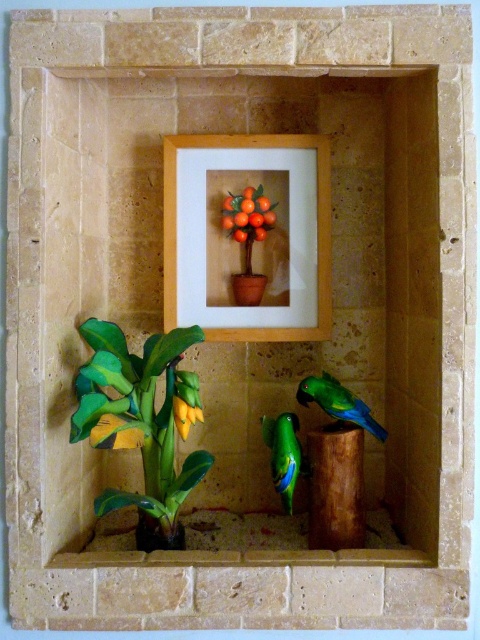
Is orange matte/orange-painted flower at upper center to the left of yellow matte flower at lower center from the viewer's perspective?

Incorrect, orange matte/orange-painted flower at upper center is not on the left side of yellow matte flower at lower center.

Does orange matte/orange-painted flower at upper center appear on the right side of yellow matte flower at lower center?

Yes, orange matte/orange-painted flower at upper center is to the right of yellow matte flower at lower center.

Between point (237, 220) and point (189, 396), which one is positioned in front?

Point (189, 396) is more forward.

Find the location of a particular element. This screenshot has width=480, height=640. orange matte/orange-painted flower at upper center is located at coordinates (248, 214).

Who is lower down, wooden frame at center or green matte parrot at lower right?

Positioned lower is green matte parrot at lower right.

Who is higher up, wooden frame at center or green matte parrot at lower right?

wooden frame at center is higher up.

Locate an element on the screen. Image resolution: width=480 pixels, height=640 pixels. wooden frame at center is located at coordinates (316, 230).

Is orange matte/orange-painted flower at upper center thinner than matte green vase at lower left?

No.

Between orange matte/orange-painted flower at upper center and matte green vase at lower left, which one is positioned lower?

matte green vase at lower left

Who is more distant from viewer, (259, 240) or (168, 548)?

The point (259, 240) is behind.

Where is `orange matte/orange-painted flower at upper center`? orange matte/orange-painted flower at upper center is located at coordinates (248, 214).